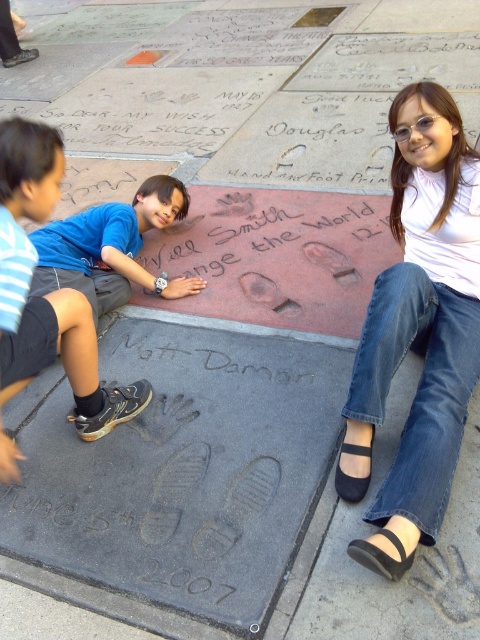
Who is positioned more to the left, blue fabric shirt at center or black ink writing at center?

blue fabric shirt at center is more to the left.

Is point (100, 243) positioned before point (257, 365)?

No, (100, 243) is further to viewer.

Which is behind, point (66, 248) or point (279, 378)?

The point (66, 248) is more distant.

At what (x,y) coordinates should I click in order to perform the action: click on blue fabric shirt at center. Please return your answer as a coordinate pair (x, y). Looking at the image, I should click on (109, 248).

Between white matte shirt at upper right and black suede sandal at lower right, which one appears on the right side from the viewer's perspective?

white matte shirt at upper right is more to the right.

Between white matte shirt at upper right and black suede sandal at lower right, which one has more height?

white matte shirt at upper right is taller.

Is point (458, 324) in front of point (345, 488)?

That is False.

Where is `white matte shirt at upper right`? The width and height of the screenshot is (480, 640). white matte shirt at upper right is located at coordinates (420, 324).

Is point (95, 243) behind point (336, 477)?

Yes, point (95, 243) is behind point (336, 477).

Between blue fabric shirt at center and black suede sandal at lower right, which one has more height?

With more height is blue fabric shirt at center.

Is point (132, 269) positioned before point (367, 449)?

No.

Image resolution: width=480 pixels, height=640 pixels. Find the location of `blue fabric shirt at center`. blue fabric shirt at center is located at coordinates (109, 248).